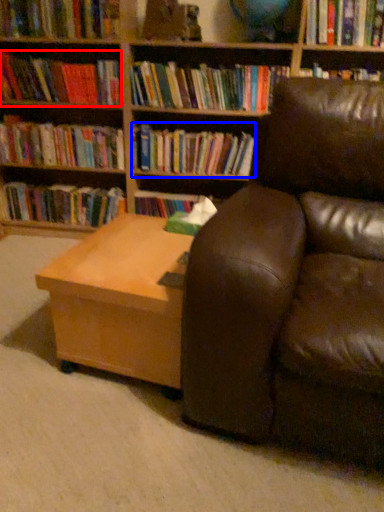
Question: Among these objects, which one is farthest to the camera, book (highlighted by a red box) or book (highlighted by a blue box)?

Choices:
 (A) book
 (B) book

Answer: (B)